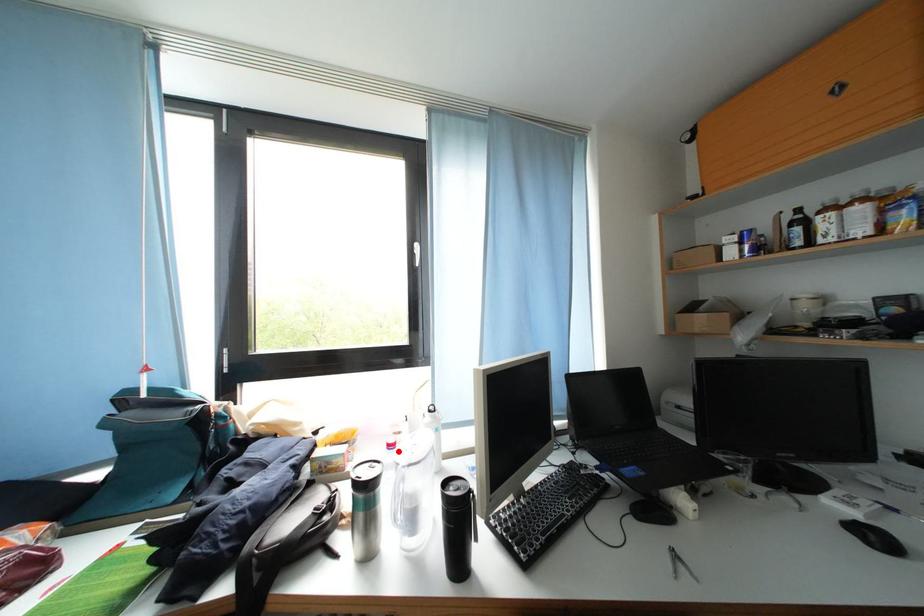
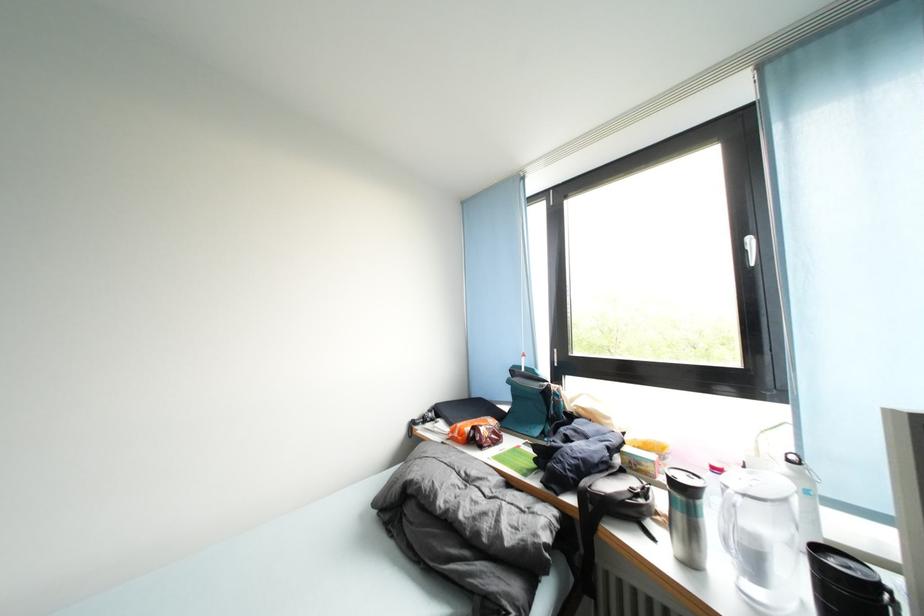
In the second image, find the point that corresponds to the highlighted location in the first image.

(723, 475)